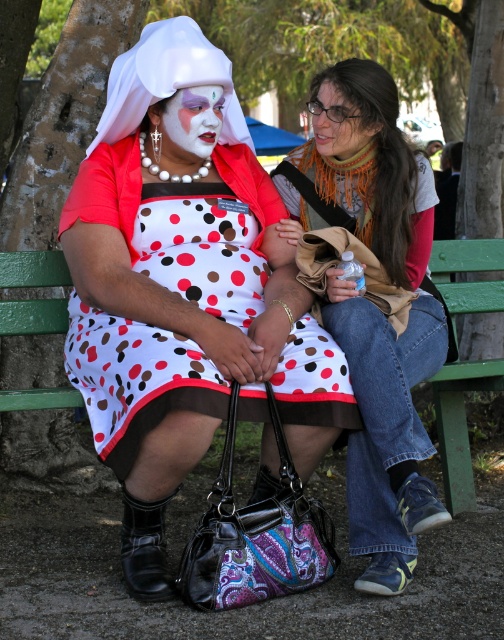
You are taking a photo of two points in the image. The first point is at coordinate point (173, 422) and the second point is at coordinate point (200, 125). Which point will appear larger in your photo?

Point (173, 422) is closer to the camera than point (200, 125), so it will appear larger in the photo.

Based on the scene description, can you determine which object is taller between the polka dot dress at center and the white matte face paint at center?

The polka dot dress at center is taller than the white matte face paint at center according to the description.

You are a photographer standing in front of the two individuals on the park bench. You notice two points marked in the image at coordinates point (457, 452) and point (192, 141). Which point is closer to your camera?

Point (457, 452) is further to the camera than point (192, 141), so the point closer to the camera is point (192, 141).